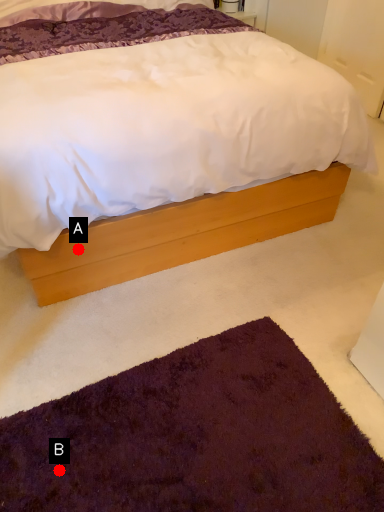
Question: Two points are circled on the image, labeled by A and B beside each circle. Which point is closer to the camera?

Choices:
 (A) A is closer
 (B) B is closer

Answer: (B)